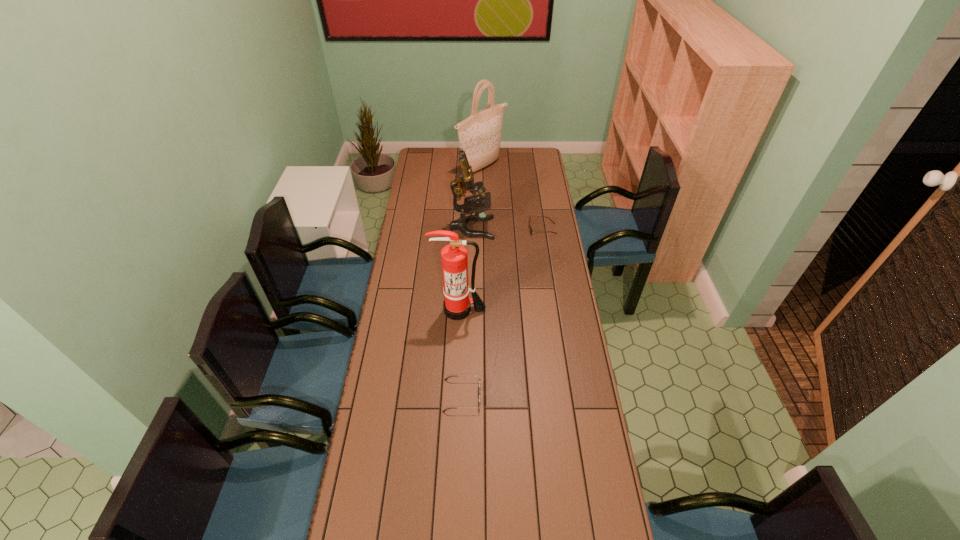
This screenshot has height=540, width=960. What are the coordinates of `vacant space at the far left corner` in the screenshot? It's located at (419, 148).

Image resolution: width=960 pixels, height=540 pixels. In order to click on unoccupied area between the shopping bag and the right sunglasses in this screenshot , I will do `click(512, 198)`.

Locate an element on the screen. vacant region between the tallest object and the fire extinguisher is located at coordinates (470, 239).

Where is `the third closest object to the nearest object`? This screenshot has height=540, width=960. the third closest object to the nearest object is located at coordinates click(530, 228).

Select which object is the closest to the nearest object. Please provide its 2D coordinates. Your answer should be formatted as a tuple, i.e. [(x, y)], where the tuple contains the x and y coordinates of a point satisfying the conditions above.

[(457, 305)]

What are the coordinates of `the closest sunglasses to the microscope` in the screenshot? It's located at (530, 228).

Locate an element on the screen. The height and width of the screenshot is (540, 960). sunglasses that is the closest to the microscope is located at coordinates (530, 228).

Where is `vacant space that satisfies the following two spatial constraints: 1. at the eyepieces of the microscope; 2. at the nozzle of the second nearest object`? vacant space that satisfies the following two spatial constraints: 1. at the eyepieces of the microscope; 2. at the nozzle of the second nearest object is located at coordinates (470, 310).

Find the location of a particular element. Image resolution: width=960 pixels, height=540 pixels. free space in the image that satisfies the following two spatial constraints: 1. on the front-facing side of the right sunglasses; 2. at the nozzle of the fourth farthest object is located at coordinates (554, 310).